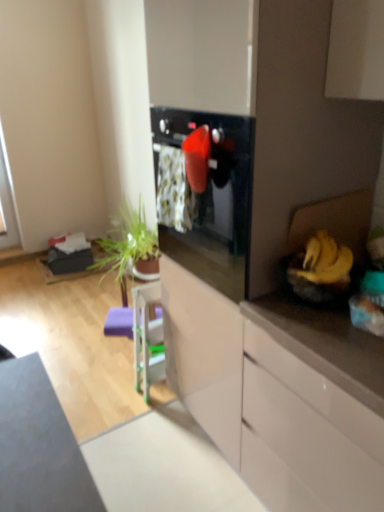
Question: Can you see white glossy cabinet at center, the 2th cabinetry when ordered from front to back, touching white glossy dresser at center?

Choices:
 (A) yes
 (B) no

Answer: (B)

Question: Is white glossy cabinet at center, the 2th cabinetry when ordered from front to back, further to the viewer compared to white glossy dresser at center?

Choices:
 (A) yes
 (B) no

Answer: (A)

Question: Are white glossy cabinet at center, arranged as the first cabinetry when viewed from the back, and white glossy dresser at center located far from each other?

Choices:
 (A) yes
 (B) no

Answer: (B)

Question: Considering the relative positions of white glossy cabinet at center, arranged as the first cabinetry when viewed from the back, and white glossy dresser at center in the image provided, is white glossy cabinet at center, arranged as the first cabinetry when viewed from the back, in front of white glossy dresser at center?

Choices:
 (A) no
 (B) yes

Answer: (A)

Question: Does white glossy cabinet at center, the 2th cabinetry when ordered from front to back, have a greater height compared to white glossy dresser at center?

Choices:
 (A) yes
 (B) no

Answer: (B)

Question: Based on their positions, is yellow matte banana at right located to the left or right of white glossy dresser at center?

Choices:
 (A) left
 (B) right

Answer: (B)

Question: Is yellow matte banana at right bigger or smaller than white glossy dresser at center?

Choices:
 (A) small
 (B) big

Answer: (A)

Question: Is yellow matte banana at right situated inside white glossy dresser at center or outside?

Choices:
 (A) inside
 (B) outside

Answer: (B)

Question: Relative to white glossy dresser at center, is yellow matte banana at right in front or behind?

Choices:
 (A) behind
 (B) front

Answer: (A)

Question: Is point (326, 276) positioned closer to the camera than point (327, 464)?

Choices:
 (A) closer
 (B) farther

Answer: (B)

Question: Considering the positions of yellow matte banana at right and white glossy cabinet at right, which ranks as the first cabinetry in front-to-back order, in the image, is yellow matte banana at right bigger or smaller than white glossy cabinet at right, which ranks as the first cabinetry in front-to-back order,?

Choices:
 (A) small
 (B) big

Answer: (A)

Question: From the image's perspective, is yellow matte banana at right above or below white glossy cabinet at right, which ranks as the first cabinetry in front-to-back order?

Choices:
 (A) above
 (B) below

Answer: (A)

Question: From a real-world perspective, relative to white glossy cabinet at right, which ranks as the first cabinetry in front-to-back order, is yellow matte banana at right vertically above or below?

Choices:
 (A) above
 (B) below

Answer: (A)

Question: Is white glossy dresser at center spatially inside white glossy cabinet at right, which ranks as the first cabinetry in front-to-back order, or outside of it?

Choices:
 (A) inside
 (B) outside

Answer: (B)

Question: Visually, is white glossy dresser at center positioned to the left or to the right of white glossy cabinet at right, which ranks as the first cabinetry in front-to-back order?

Choices:
 (A) right
 (B) left

Answer: (B)